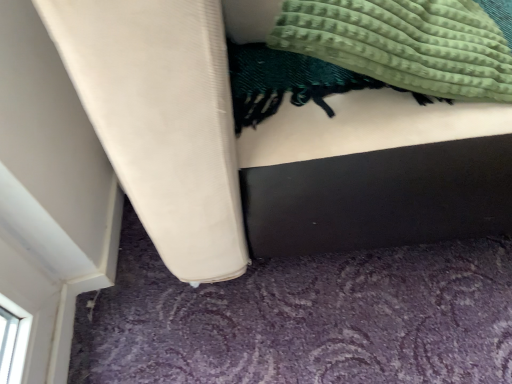
Image resolution: width=512 pixels, height=384 pixels. Find the location of `matte white bed at center`. matte white bed at center is located at coordinates (162, 120).

This screenshot has height=384, width=512. What do you see at coordinates (162, 120) in the screenshot?
I see `matte white bed at center` at bounding box center [162, 120].

What is the approximate height of green textured blanket at upper right?

8.38 inches.

Describe the element at coordinates (288, 82) in the screenshot. This screenshot has height=384, width=512. I see `green textured blanket at upper right` at that location.

Image resolution: width=512 pixels, height=384 pixels. I want to click on green textured blanket at upper right, so click(288, 82).

Locate an element on the screen. This screenshot has height=384, width=512. matte white bed at center is located at coordinates (162, 120).

Is green textured blanket at upper right at the left side of matte white bed at center?

Yes.

Considering the positions of objects green textured blanket at upper right and matte white bed at center in the image provided, who is behind, green textured blanket at upper right or matte white bed at center?

Positioned behind is green textured blanket at upper right.

Does point (230, 43) appear closer or farther from the camera than point (150, 174)?

Point (230, 43) is farther from the camera than point (150, 174).

From the image's perspective, which one is positioned lower, green textured blanket at upper right or matte white bed at center?

green textured blanket at upper right, from the image's perspective.

From a real-world perspective, is green textured blanket at upper right on matte white bed at center?

Yes.

Considering the relative sizes of green textured blanket at upper right and matte white bed at center in the image provided, is green textured blanket at upper right thinner than matte white bed at center?

Yes, green textured blanket at upper right is thinner than matte white bed at center.

Considering the sizes of green textured blanket at upper right and matte white bed at center in the image, is green textured blanket at upper right taller or shorter than matte white bed at center?

Considering their sizes, green textured blanket at upper right has less height than matte white bed at center.

Who is smaller, green textured blanket at upper right or matte white bed at center?

green textured blanket at upper right.

Choose the correct answer: Is green textured blanket at upper right inside matte white bed at center or outside it?

green textured blanket at upper right is inside matte white bed at center.

Are green textured blanket at upper right and matte white bed at center far apart?

Actually, green textured blanket at upper right and matte white bed at center are a little close together.

Is green textured blanket at upper right positioned with its back to matte white bed at center?

Correct, green textured blanket at upper right is looking away from matte white bed at center.

Can you tell me how much green textured blanket at upper right and matte white bed at center differ in facing direction?

They differ by 0.000599 degrees in their facing directions.

In order to click on blanket below the matte white bed at center (from the image's perspective) in this screenshot , I will do `click(288, 82)`.

In the image, is matte white bed at center on the left side or the right side of green textured blanket at upper right?

From the image, it's evident that matte white bed at center is to the right of green textured blanket at upper right.

Considering their positions, is matte white bed at center located in front of or behind green textured blanket at upper right?

Clearly, matte white bed at center is in front of green textured blanket at upper right.

Between point (121, 160) and point (250, 98), which one is positioned in front?

Point (121, 160)

From the image's perspective, is matte white bed at center above or below green textured blanket at upper right?

matte white bed at center is situated higher than green textured blanket at upper right in the image.

From a real-world perspective, which object stands above the other?

green textured blanket at upper right.

Looking at their sizes, would you say matte white bed at center is wider or thinner than green textured blanket at upper right?

Considering their sizes, matte white bed at center looks broader than green textured blanket at upper right.

Between matte white bed at center and green textured blanket at upper right, which one has more height?

With more height is matte white bed at center.

Considering the sizes of objects matte white bed at center and green textured blanket at upper right in the image provided, who is smaller, matte white bed at center or green textured blanket at upper right?

green textured blanket at upper right.

In the scene shown: Can we say matte white bed at center lies outside green textured blanket at upper right?

Yes.

Is matte white bed at center far from green textured blanket at upper right?

No, there isn't a large distance between matte white bed at center and green textured blanket at upper right.

Is matte white bed at center facing towards green textured blanket at upper right?

Yes, matte white bed at center faces towards green textured blanket at upper right.

What's the angular difference between matte white bed at center and green textured blanket at upper right's facing directions?

The angle between the facing direction of matte white bed at center and the facing direction of green textured blanket at upper right is 0.000599 degrees.

Where is `blanket located on the left of matte white bed at center`? Image resolution: width=512 pixels, height=384 pixels. blanket located on the left of matte white bed at center is located at coordinates (288, 82).

Locate an element on the screen. The width and height of the screenshot is (512, 384). blanket lying on the left of matte white bed at center is located at coordinates (288, 82).

You are a GUI agent. You are given a task and a screenshot of the screen. Output one action in this format:
    pyautogui.click(x=<x>, y=<y>)
    Task: Click on the furniture below the green textured blanket at upper right (from a real-world perspective)
    This screenshot has width=512, height=384.
    Given the screenshot: What is the action you would take?
    pyautogui.click(x=162, y=120)